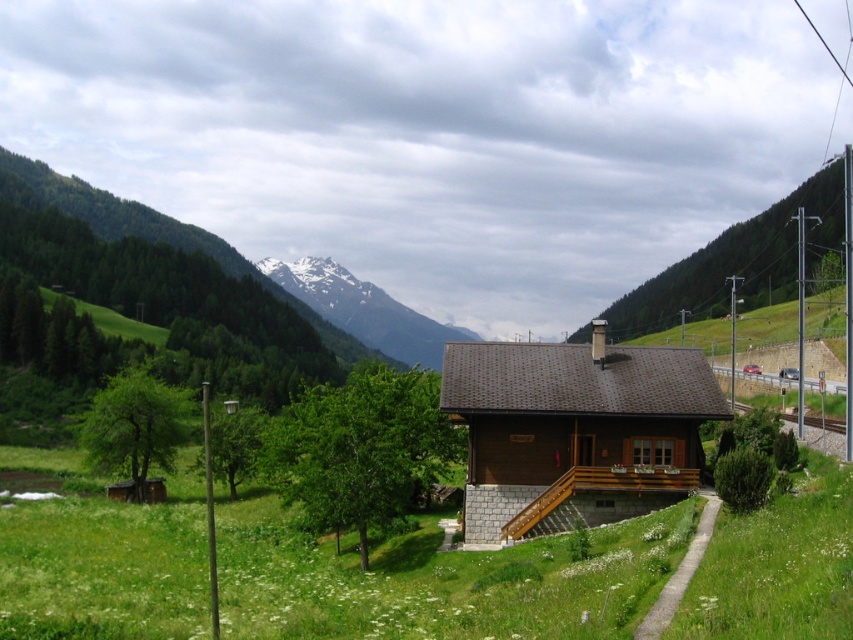
Question: Does green grassy at lower center appear over metal/smooth train track at lower right?

Choices:
 (A) yes
 (B) no

Answer: (B)

Question: Which object appears farthest from the camera in this image?

Choices:
 (A) metal/smooth train track at lower right
 (B) green grassy at lower center
 (C) snowy rock mountain at upper center

Answer: (C)

Question: Which object appears farthest from the camera in this image?

Choices:
 (A) snowy rock mountain at upper center
 (B) green grassy at lower center

Answer: (A)

Question: Does snowy rock mountain at upper center have a greater width compared to metal/smooth train track at lower right?

Choices:
 (A) no
 (B) yes

Answer: (B)

Question: Among these points, which one is farthest from the camera?

Choices:
 (A) (349, 284)
 (B) (792, 419)
 (C) (396, 579)

Answer: (A)

Question: Does green grassy at lower center appear on the left side of metal/smooth train track at lower right?

Choices:
 (A) yes
 (B) no

Answer: (A)